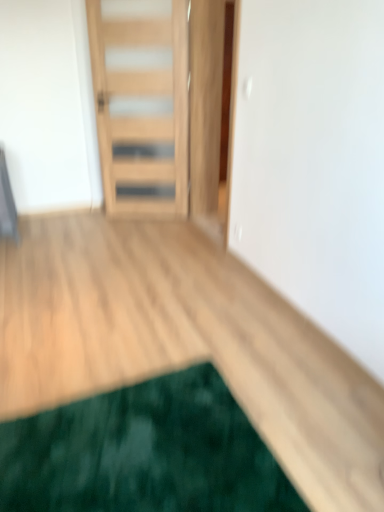
Question: Is green plush mat at lower left inside the boundaries of natural wood door at center, or outside?

Choices:
 (A) outside
 (B) inside

Answer: (A)

Question: Looking at their shapes, would you say green plush mat at lower left is wider or thinner than natural wood door at center?

Choices:
 (A) wide
 (B) thin

Answer: (A)

Question: Visually, is green plush mat at lower left positioned to the left or to the right of natural wood door at center?

Choices:
 (A) right
 (B) left

Answer: (A)

Question: From their relative heights in the image, would you say natural wood door at center is taller or shorter than green plush mat at lower left?

Choices:
 (A) short
 (B) tall

Answer: (B)

Question: Would you say natural wood door at center is inside or outside green plush mat at lower left?

Choices:
 (A) outside
 (B) inside

Answer: (A)

Question: From the image's perspective, is natural wood door at center positioned above or below green plush mat at lower left?

Choices:
 (A) below
 (B) above

Answer: (B)

Question: Is natural wood door at center bigger or smaller than green plush mat at lower left?

Choices:
 (A) small
 (B) big

Answer: (B)